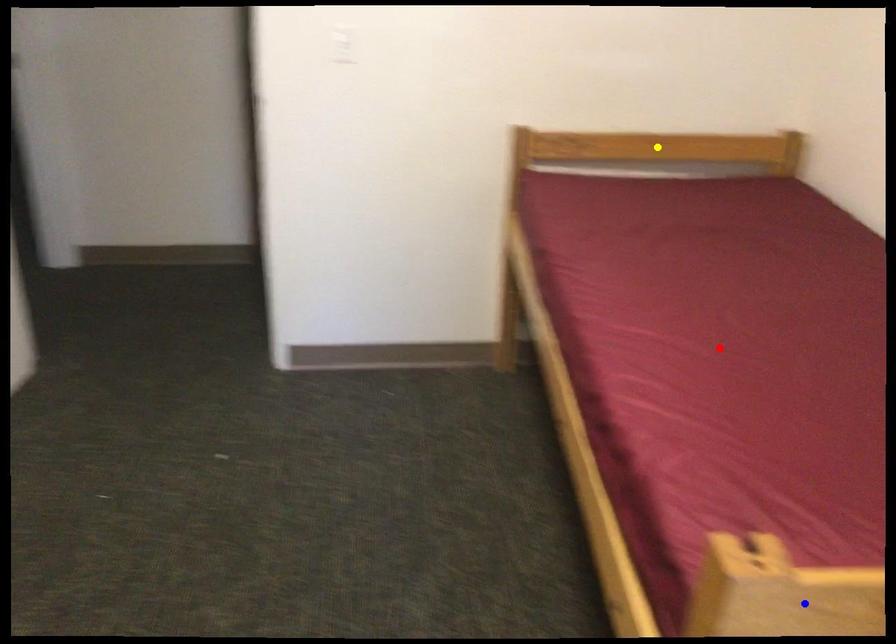
Order these from nearest to farthest:
yellow point
blue point
red point

1. blue point
2. red point
3. yellow point